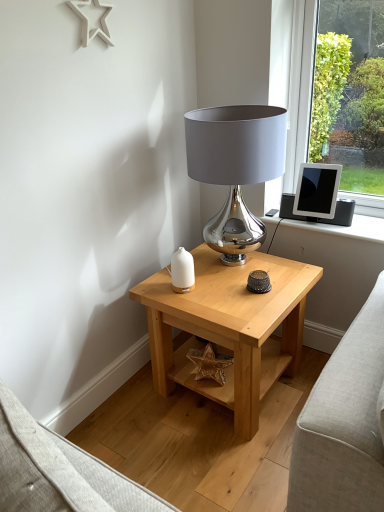
Question: From the image's perspective, is natural wood side table at center located above or below white glossy vase at center?

Choices:
 (A) above
 (B) below

Answer: (B)

Question: From a real-world perspective, is natural wood side table at center positioned above or below white glossy vase at center?

Choices:
 (A) above
 (B) below

Answer: (B)

Question: Which object is the farthest from the white glossy vase at center?

Choices:
 (A) shiny metallic lamp at upper center
 (B) silver metallic tablet at upper right
 (C) natural wood side table at center

Answer: (B)

Question: Which object is positioned farthest from the white glossy vase at center?

Choices:
 (A) natural wood side table at center
 (B) silver metallic tablet at upper right
 (C) shiny metallic lamp at upper center

Answer: (B)